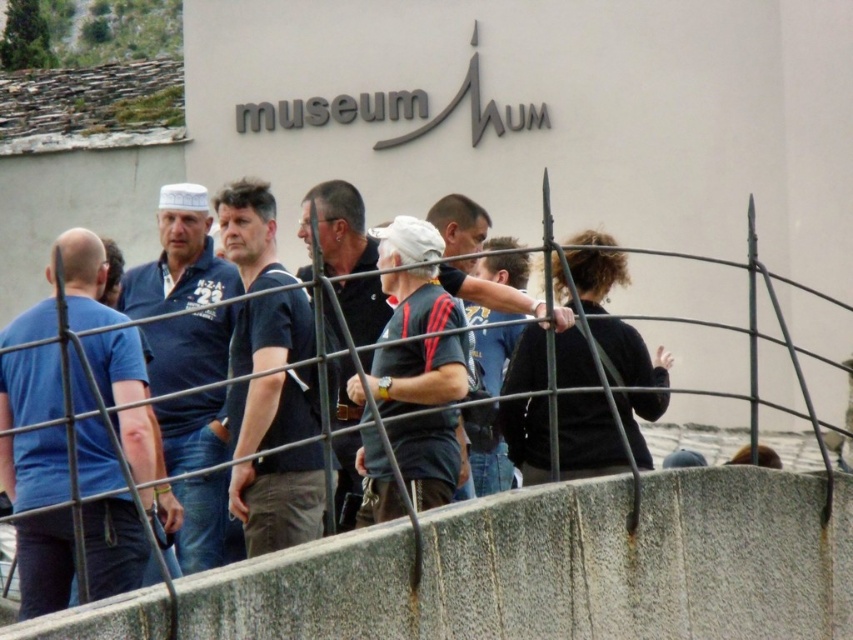
You are a photographer trying to capture a group photo of the matte black shirt at center and the dark gray fabric shirt at center. Which person should you position closer to the camera to ensure both are in focus?

The matte black shirt at center is much taller than the dark gray fabric shirt at center, so positioning the dark gray fabric shirt at center closer to the camera will help ensure both are in focus.

In the scene described, where is the matte black shirt at center located in terms of coordinates?

The matte black shirt at center is located at point coordinates of (337, 228).